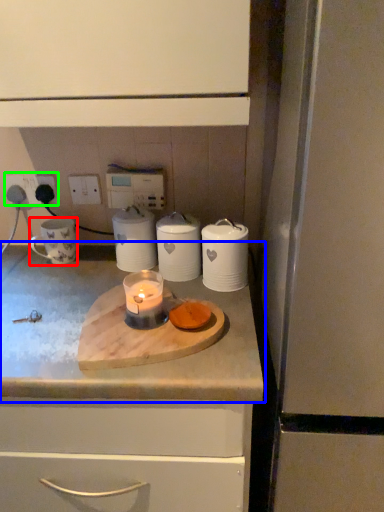
Question: Which object is the farthest from mug (highlighted by a red box)? Choose among these: countertop (highlighted by a blue box) or electric outlet (highlighted by a green box).

Choices:
 (A) countertop
 (B) electric outlet

Answer: (A)